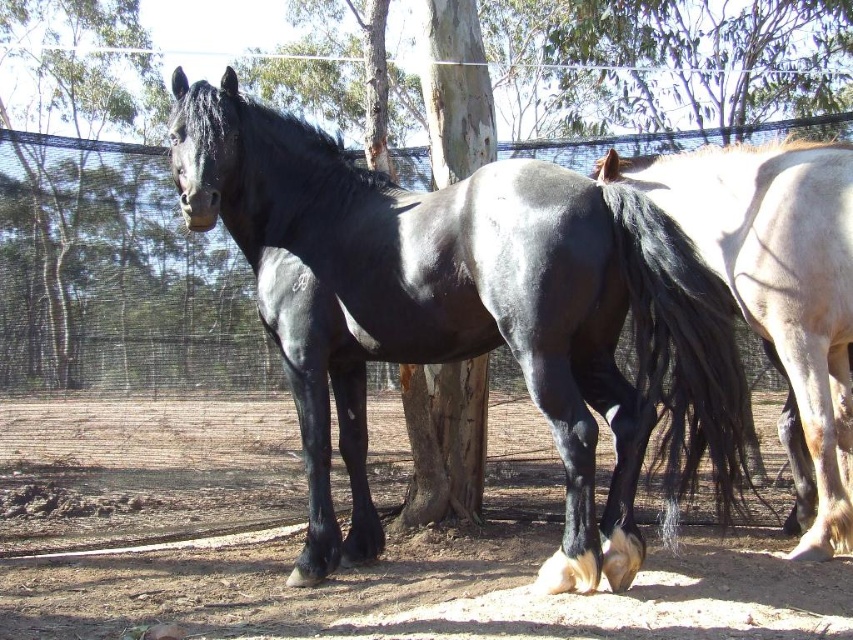
Does smooth bark tree at center have a greater width compared to black glossy horse at right?

Yes.

Describe the element at coordinates (102, 259) in the screenshot. I see `smooth bark tree at center` at that location.

Find the location of a particular element. This screenshot has width=853, height=640. smooth bark tree at center is located at coordinates (102, 259).

Locate an element on the screen. The height and width of the screenshot is (640, 853). black glossy horse at center is located at coordinates (468, 310).

Is black glossy horse at center shorter than smooth bark tree at center?

Correct, black glossy horse at center is not as tall as smooth bark tree at center.

From the picture: Who is more forward, (508, 244) or (36, 246)?

Point (508, 244)

At what (x,y) coordinates should I click in order to perform the action: click on black glossy horse at center. Please return your answer as a coordinate pair (x, y). Looking at the image, I should click on (468, 310).

In order to click on dirt field at lower center in this screenshot , I will do `click(430, 588)`.

Does dirt field at lower center appear under smooth bark tree at center?

Correct, dirt field at lower center is located below smooth bark tree at center.

The image size is (853, 640). In order to click on dirt field at lower center in this screenshot , I will do `click(430, 588)`.